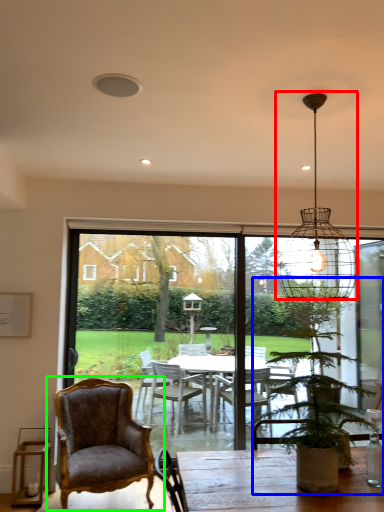
Question: Which object is positioned closest to light fixture (highlighted by a red box)? Select from houseplant (highlighted by a blue box) and chair (highlighted by a green box).

Choices:
 (A) houseplant
 (B) chair

Answer: (A)